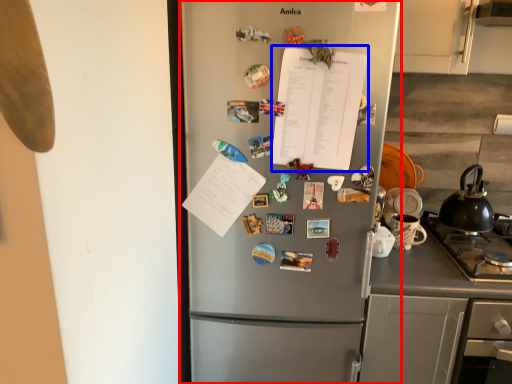
Question: Which point is closer to the camera, refrigerator (highlighted by a red box) or notebook (highlighted by a blue box)?

Choices:
 (A) refrigerator
 (B) notebook

Answer: (A)